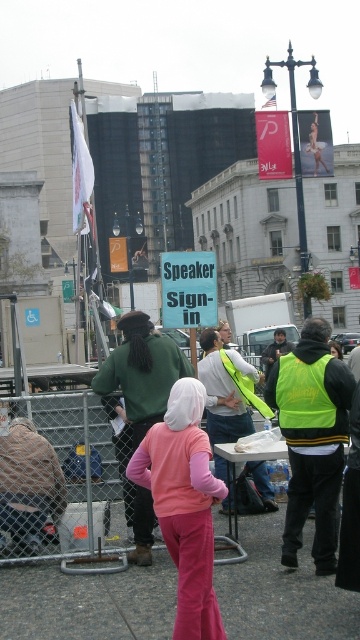
Question: Does pink fabric pants at lower center appear on the left side of neon yellow safety vest at center?

Choices:
 (A) no
 (B) yes

Answer: (B)

Question: Which object is closer to the camera taking this photo?

Choices:
 (A) light pink fleece at center
 (B) neon yellow safety vest at center
 (C) pink fabric pants at lower center
 (D) neon yellow vest at right

Answer: (C)

Question: Which object is positioned farthest from the pink velour pants at center?

Choices:
 (A) neon yellow vest at right
 (B) pink fabric pants at lower center
 (C) light pink fleece at center
 (D) neon yellow safety vest at center

Answer: (C)

Question: Is pink velour pants at center behind light pink fleece at center?

Choices:
 (A) no
 (B) yes

Answer: (A)

Question: Which of these objects is positioned closest to the neon yellow safety vest at center?

Choices:
 (A) pink velour pants at center
 (B) neon yellow vest at right
 (C) pink fabric pants at lower center

Answer: (B)

Question: Can you confirm if pink fabric pants at lower center is positioned to the right of neon yellow vest at right?

Choices:
 (A) no
 (B) yes

Answer: (A)